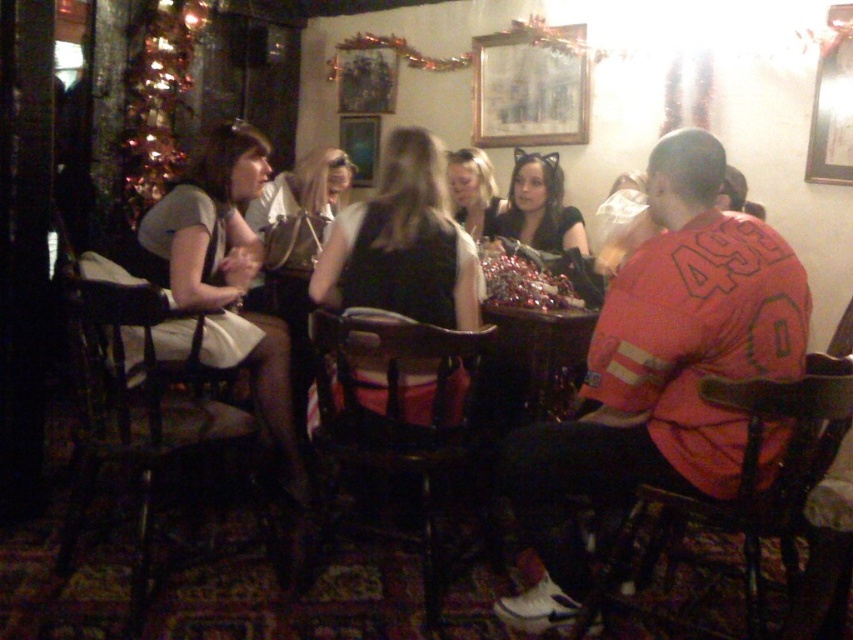
Does black matte dress at center have a lesser width compared to matte black dress at center?

In fact, black matte dress at center might be wider than matte black dress at center.

Locate an element on the screen. black matte dress at center is located at coordinates (403, 243).

Between red jersey at center and black matte dress at center, which one has more height?

Standing taller between the two is red jersey at center.

Can you confirm if red jersey at center is positioned above black matte dress at center?

No, red jersey at center is not above black matte dress at center.

Measure the distance between red jersey at center and camera.

red jersey at center is 5.54 feet away from camera.

I want to click on red jersey at center, so click(659, 369).

Based on the photo, which of these two, matte black dress at center or blonde hair at center, stands taller?

Standing taller between the two is blonde hair at center.

Which of these two, matte black dress at center or blonde hair at center, stands shorter?

matte black dress at center

Is point (534, 193) more distant than point (271, 189)?

No, (534, 193) is closer to viewer.

The height and width of the screenshot is (640, 853). In order to click on matte black dress at center in this screenshot , I will do `click(540, 205)`.